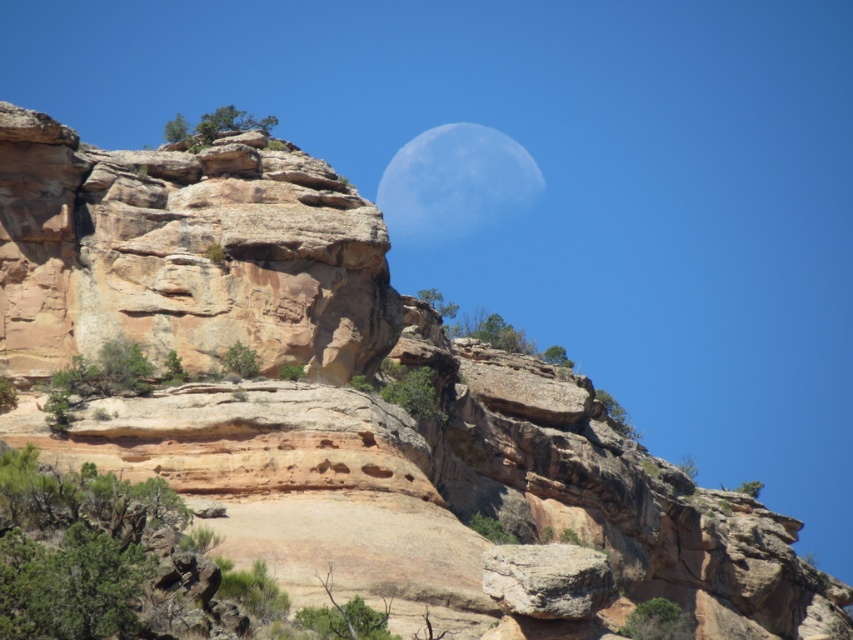
You are an astronaut on Mars and you see the rustic sandstone cliff at upper left and the rustic brown rock at center. Which object is bigger?

The rustic sandstone cliff at upper left is larger in size compared to the rustic brown rock at center.